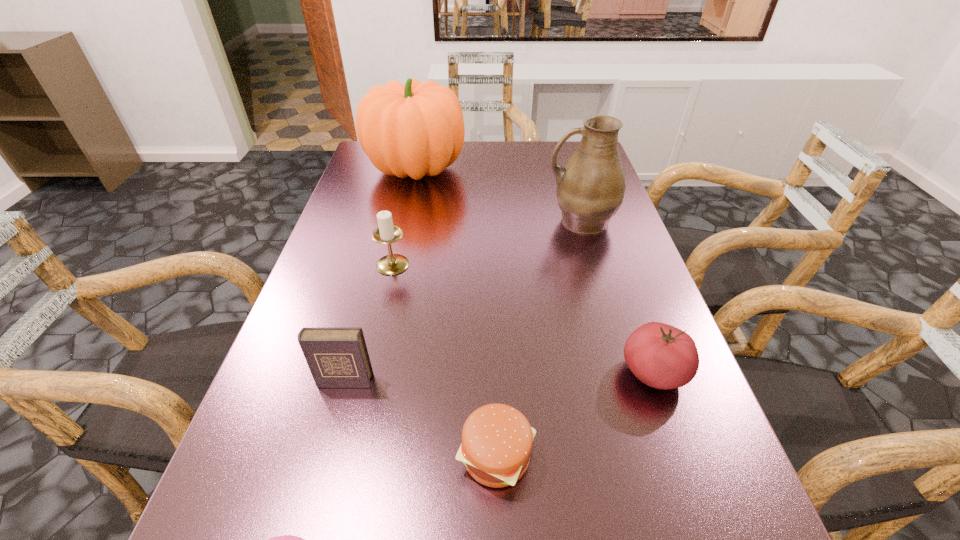
You are a GUI agent. You are given a task and a screenshot of the screen. Output one action in this format:
    pyautogui.click(x=<x>, y=<y>)
    Task: Click on the vacant space located 0.340m on the handle side of the second farthest object
    The height and width of the screenshot is (540, 960).
    Given the screenshot: What is the action you would take?
    pyautogui.click(x=411, y=221)

Find the location of a particular element. vacant space located 0.330m on the front of the third farthest object is located at coordinates (360, 410).

You are a GUI agent. You are given a task and a screenshot of the screen. Output one action in this format:
    pyautogui.click(x=<x>, y=<y>)
    Task: Click on the free location located on the front cover of the diary
    The image size is (960, 540).
    Given the screenshot: What is the action you would take?
    pyautogui.click(x=333, y=426)

Where is `vacant space located on the back of the tomato`? Image resolution: width=960 pixels, height=540 pixels. vacant space located on the back of the tomato is located at coordinates (621, 280).

Locate an element on the screen. The image size is (960, 540). vacant point located on the right of the sixth farthest object is located at coordinates (609, 456).

Image resolution: width=960 pixels, height=540 pixels. What are the coordinates of `object at the far edge` in the screenshot? It's located at (416, 129).

Where is `pumpkin that is at the left edge`? This screenshot has height=540, width=960. pumpkin that is at the left edge is located at coordinates (416, 129).

Identify the location of candle holder that is at the left edge. This screenshot has width=960, height=540. (391, 264).

At what (x,y) coordinates should I click in order to perform the action: click on diary that is positioned at the left edge. Please return your answer as a coordinate pair (x, y). This screenshot has height=540, width=960. Looking at the image, I should click on (337, 357).

Where is `pitcher positioned at the right edge`? Image resolution: width=960 pixels, height=540 pixels. pitcher positioned at the right edge is located at coordinates (590, 189).